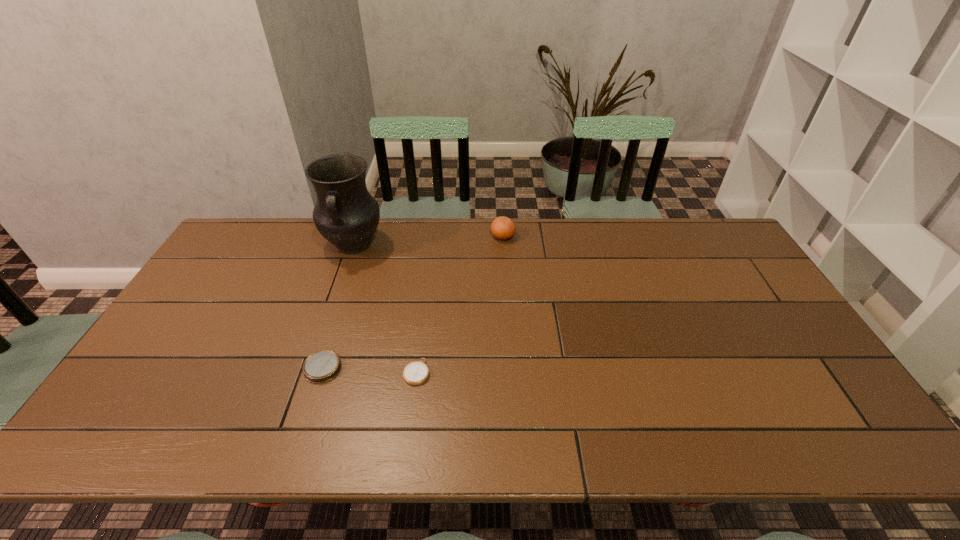
Identify the location of vacant space located on the back of the shorter compass. (424, 314).

In order to click on pitcher located in the far edge section of the desktop in this screenshot , I will do `click(345, 214)`.

Identify the location of clementine that is positioned at the far edge. (503, 228).

This screenshot has width=960, height=540. In the image, there is a desktop. In order to click on free space at the far edge in this screenshot , I will do `click(665, 250)`.

The width and height of the screenshot is (960, 540). What are the coordinates of `vacant space at the near edge of the desktop` in the screenshot? It's located at (524, 438).

In the image, there is a desktop. Identify the location of vacant space at the left edge. The height and width of the screenshot is (540, 960). (228, 287).

I want to click on free region at the right edge of the desktop, so click(830, 394).

This screenshot has width=960, height=540. I want to click on free space between the clementine and the taller compass, so click(x=413, y=302).

This screenshot has width=960, height=540. I want to click on free space between the left compass and the third object from left to right, so click(x=370, y=370).

Where is `empty location between the pitcher and the taller compass`? The width and height of the screenshot is (960, 540). empty location between the pitcher and the taller compass is located at coordinates (338, 307).